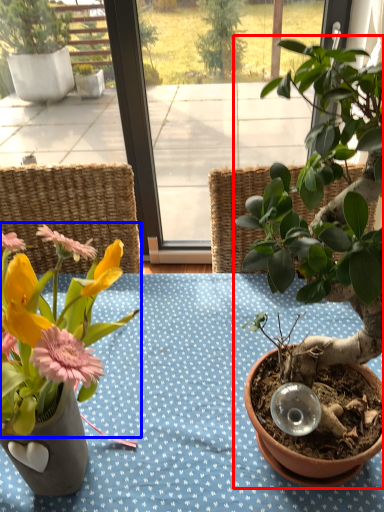
Question: Which of the following is the farthest to the observer, houseplant (highlighted by a red box) or flower (highlighted by a blue box)?

Choices:
 (A) houseplant
 (B) flower

Answer: (B)